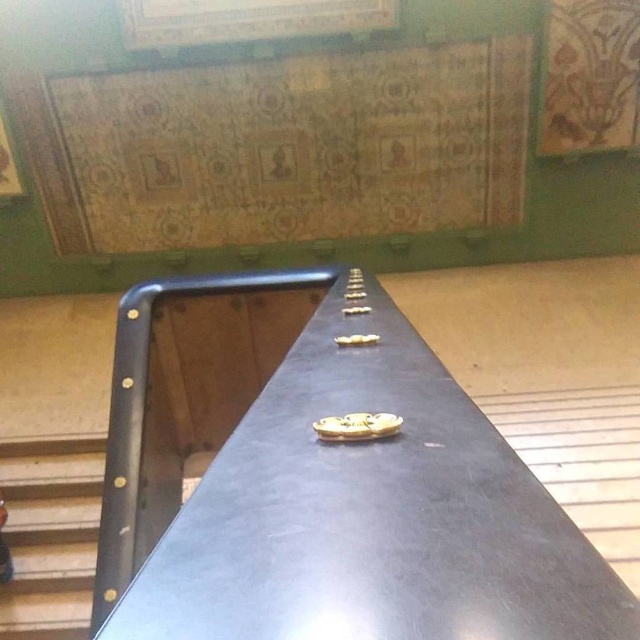
You are standing on the wooden stairs at lower left and want to reach the wooden bulletin board at upper center. Which direction should you move to get closer to it?

You should move upward because the wooden stairs at lower left is below the wooden bulletin board at upper center, so moving upward will bring you closer.